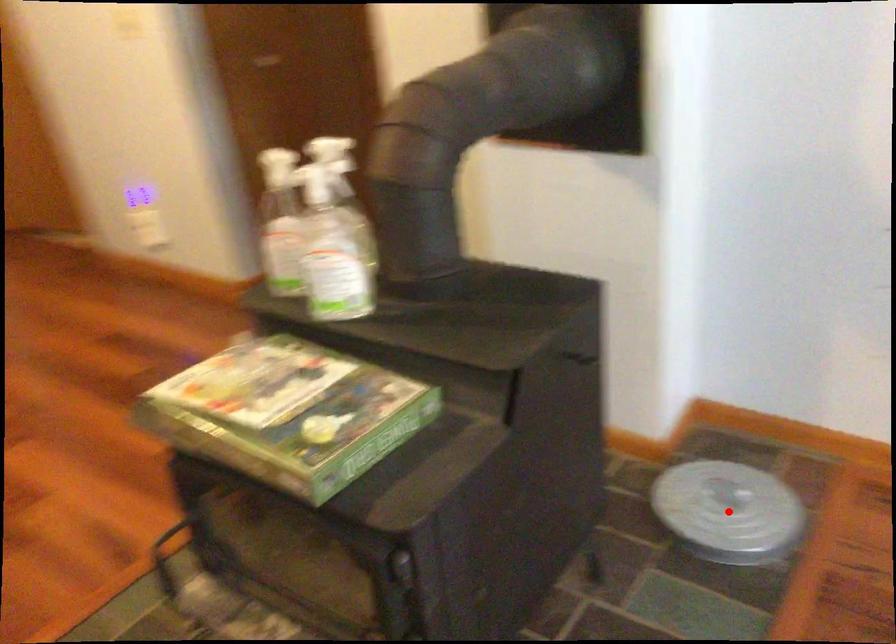
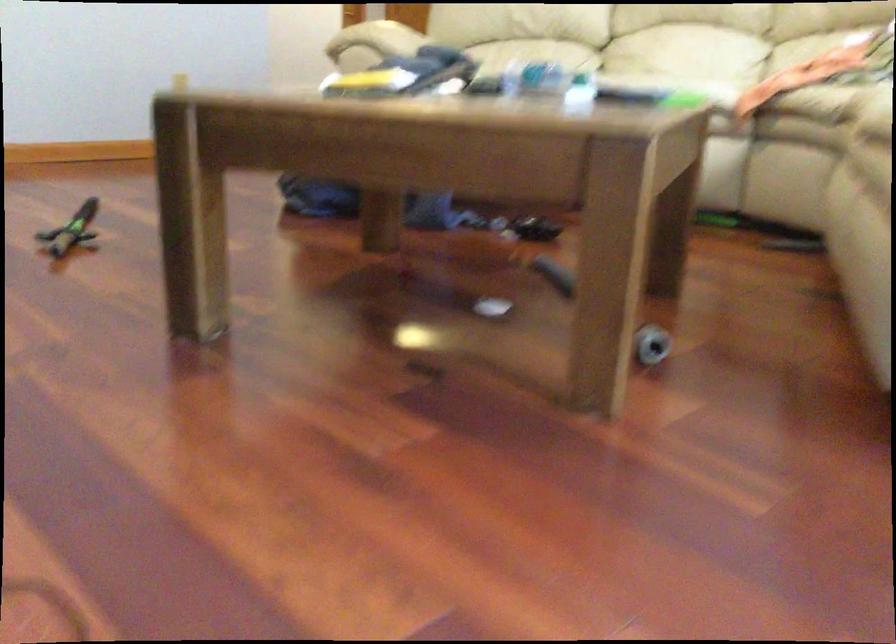
Question: I am providing you with two images of the same scene from different viewpoints. A red point is marked on the first image. At the location where the point appears in image 1, is it still visible in image 2?

Choices:
 (A) Yes
 (B) No

Answer: (B)